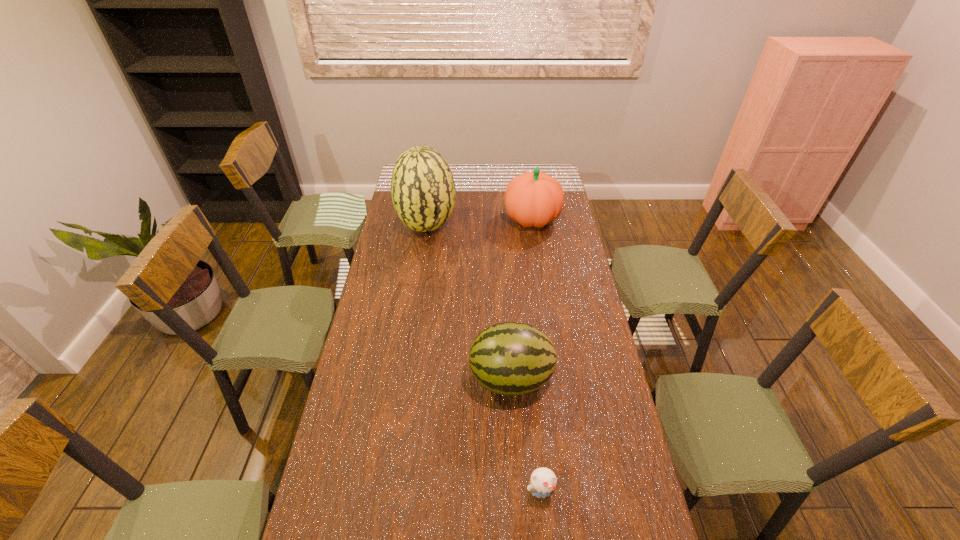
I want to click on free area in between the leftmost object and the second tallest object, so coord(479,223).

Where is `empty location between the nearest object and the right watermelon`? empty location between the nearest object and the right watermelon is located at coordinates (526, 436).

Find the location of a particular element. free space between the farther watermelon and the pumpkin is located at coordinates (479, 223).

Find the location of `object that stands as the third closest to the kitten`. object that stands as the third closest to the kitten is located at coordinates (533, 199).

Identify the location of the second closest object relative to the pumpkin. The image size is (960, 540). (510, 358).